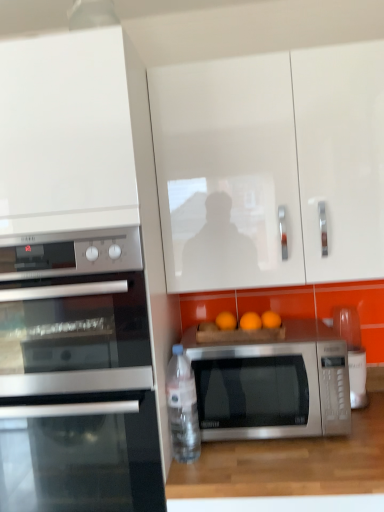
Find the location of a particular element. The height and width of the screenshot is (512, 384). free space between clear plastic bottle at lower center and satin silver microwave at center, positioned as the second microwave oven in left-to-right order is located at coordinates (248, 450).